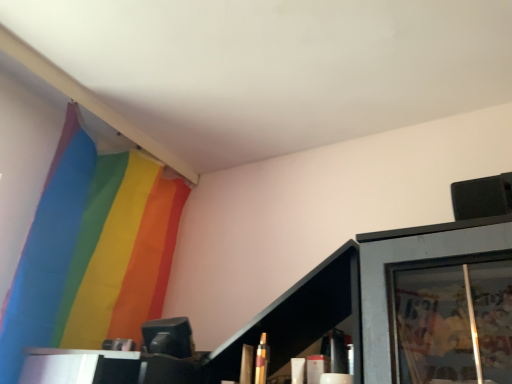
Question: Looking at the image, does matte black cabinet at lower right seem bigger or smaller compared to rainbow fabric flag at upper left?

Choices:
 (A) small
 (B) big

Answer: (A)

Question: Would you say matte black cabinet at lower right is to the left or to the right of rainbow fabric flag at upper left in the picture?

Choices:
 (A) right
 (B) left

Answer: (A)

Question: Considering their positions, is matte black cabinet at lower right located in front of or behind rainbow fabric flag at upper left?

Choices:
 (A) front
 (B) behind

Answer: (A)

Question: Is rainbow fabric flag at upper left taller or shorter than matte black cabinet at lower right?

Choices:
 (A) short
 (B) tall

Answer: (B)

Question: In the image, is rainbow fabric flag at upper left on the left side or the right side of matte black cabinet at lower right?

Choices:
 (A) right
 (B) left

Answer: (B)

Question: Relative to matte black cabinet at lower right, is rainbow fabric flag at upper left in front or behind?

Choices:
 (A) front
 (B) behind

Answer: (B)

Question: Considering the positions of rainbow fabric flag at upper left and matte black cabinet at lower right in the image, is rainbow fabric flag at upper left bigger or smaller than matte black cabinet at lower right?

Choices:
 (A) big
 (B) small

Answer: (A)